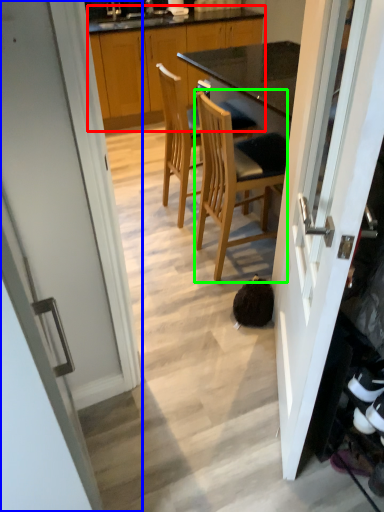
Question: Which object is the farthest from cabinetry (highlighted by a red box)? Choose among these: door (highlighted by a blue box) or chair (highlighted by a green box).

Choices:
 (A) door
 (B) chair

Answer: (A)